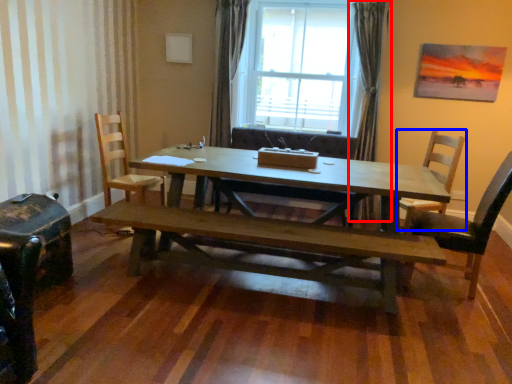
Question: Among these objects, which one is nearest to the camera, curtain (highlighted by a red box) or chair (highlighted by a blue box)?

Choices:
 (A) curtain
 (B) chair

Answer: (B)